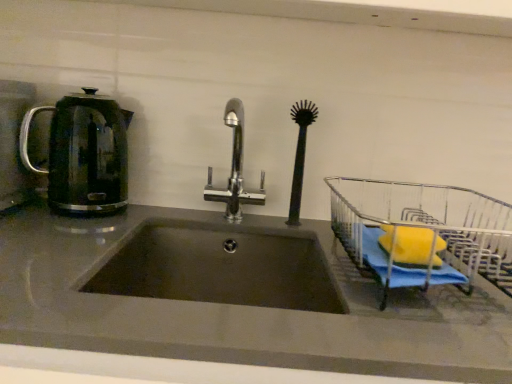
Question: Can you confirm if chrome metallic faucet at center is taller than translucent glass kettle at left?

Choices:
 (A) no
 (B) yes

Answer: (B)

Question: Does chrome metallic faucet at center have a greater width compared to translucent glass kettle at left?

Choices:
 (A) yes
 (B) no

Answer: (A)

Question: From a real-world perspective, is chrome metallic faucet at center under translucent glass kettle at left?

Choices:
 (A) yes
 (B) no

Answer: (A)

Question: Is chrome metallic faucet at center positioned in front of translucent glass kettle at left?

Choices:
 (A) yes
 (B) no

Answer: (A)

Question: Is chrome metallic faucet at center positioned behind translucent glass kettle at left?

Choices:
 (A) yes
 (B) no

Answer: (B)

Question: From a real-world perspective, relative to chrome metallic faucet at center, is translucent glass kettle at left vertically above or below?

Choices:
 (A) above
 (B) below

Answer: (A)

Question: Considering their positions, is translucent glass kettle at left located in front of or behind chrome metallic faucet at center?

Choices:
 (A) behind
 (B) front

Answer: (A)

Question: In terms of size, does translucent glass kettle at left appear bigger or smaller than chrome metallic faucet at center?

Choices:
 (A) big
 (B) small

Answer: (B)

Question: Choose the correct answer: Is translucent glass kettle at left inside chrome metallic faucet at center or outside it?

Choices:
 (A) outside
 (B) inside

Answer: (A)

Question: From the image's perspective, is black rubber brush at center located above or below metallic wire dish rack at right?

Choices:
 (A) above
 (B) below

Answer: (A)

Question: From their relative heights in the image, would you say black rubber brush at center is taller or shorter than metallic wire dish rack at right?

Choices:
 (A) short
 (B) tall

Answer: (B)

Question: Is black rubber brush at center wider or thinner than metallic wire dish rack at right?

Choices:
 (A) thin
 (B) wide

Answer: (A)

Question: Considering the relative positions of black rubber brush at center and metallic wire dish rack at right in the image provided, is black rubber brush at center to the left or to the right of metallic wire dish rack at right?

Choices:
 (A) right
 (B) left

Answer: (B)

Question: Does point (73, 104) appear closer or farther from the camera than point (222, 296)?

Choices:
 (A) farther
 (B) closer

Answer: (B)

Question: In terms of height, does translucent glass kettle at left look taller or shorter compared to dark gray matte sink at center?

Choices:
 (A) short
 (B) tall

Answer: (B)